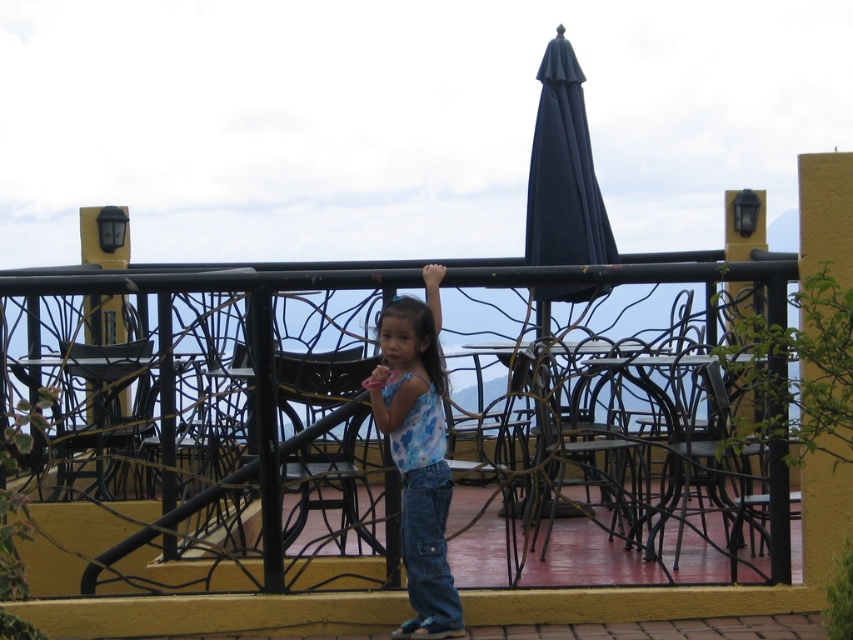
You are a photographer setting up for a family portrait. You notice two hands in the frame, the matte skin hand at center and the light skin hand at upper center. Which hand appears wider in the photo?

The matte skin hand at center appears wider than the light skin hand at upper center.

You are a photographer trying to capture the light skin hand at upper center and the black wrought iron fence at center in the same frame. Based on their positions, which object is closer to the camera?

The light skin hand at upper center is closer to the camera because it is positioned above the black wrought iron fence at center, which is located below it.